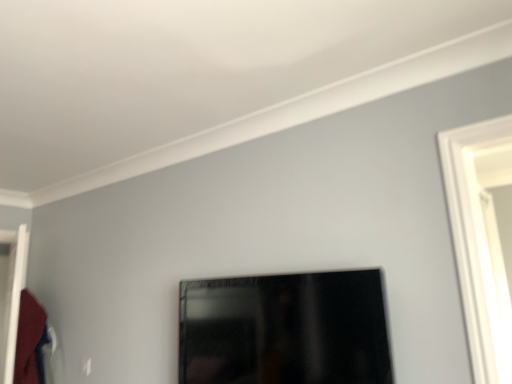
Question: Does point (290, 329) appear closer or farther from the camera than point (15, 266)?

Choices:
 (A) farther
 (B) closer

Answer: (B)

Question: Considering their positions, is matte black picture frame at center located in front of or behind white glossy door at left?

Choices:
 (A) behind
 (B) front

Answer: (B)

Question: Which of these objects is positioned farthest from the velvet red robe at left?

Choices:
 (A) matte black picture frame at center
 (B) white glossy door at left

Answer: (A)

Question: Estimate the real-world distances between objects in this image. Which object is farther from the white glossy door at left?

Choices:
 (A) matte black picture frame at center
 (B) velvet red robe at left

Answer: (A)